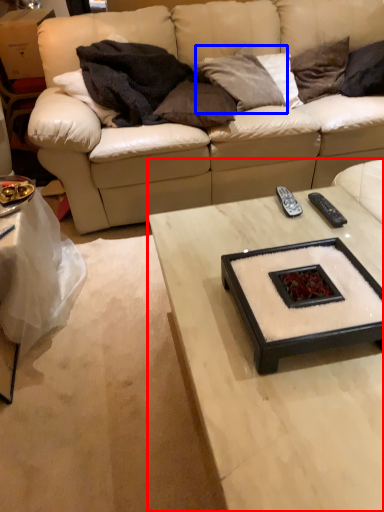
Question: Which object is further to the camera taking this photo, coffee table (highlighted by a red box) or pillow (highlighted by a blue box)?

Choices:
 (A) coffee table
 (B) pillow

Answer: (B)